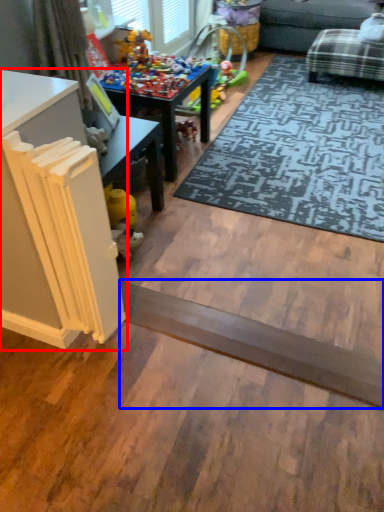
Question: Among these objects, which one is farthest to the camera, table (highlighted by a red box) or plank (highlighted by a blue box)?

Choices:
 (A) table
 (B) plank

Answer: (B)